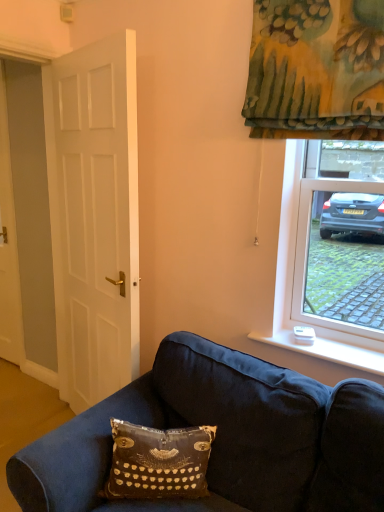
Locate an element on the screen. vacant space situated above white plastic remote control at lower right (from a real-world perspective) is located at coordinates (320, 343).